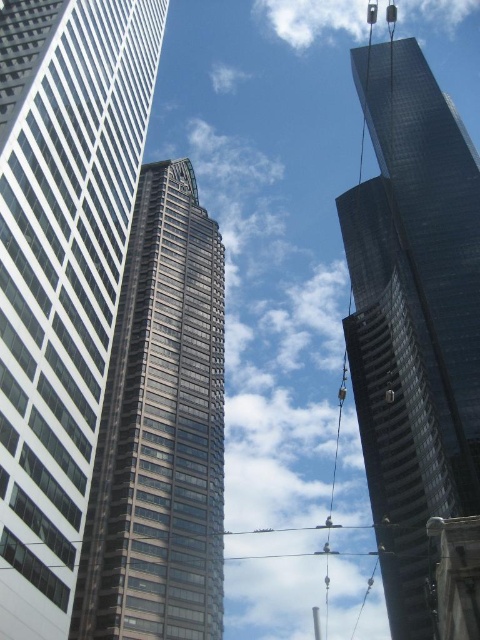
Is glossy glass skyscraper at upper right thinner than glassy reflective skyscraper at center?

Incorrect, glossy glass skyscraper at upper right's width is not less than glassy reflective skyscraper at center's.

This screenshot has width=480, height=640. Describe the element at coordinates (414, 317) in the screenshot. I see `glossy glass skyscraper at upper right` at that location.

Which is in front, point (395, 278) or point (126, 552)?

Point (126, 552) is more forward.

Find the location of `glossy glass skyscraper at upper right`. glossy glass skyscraper at upper right is located at coordinates coord(414,317).

Is white glass skyscraper at left closer to camera compared to glassy reflective skyscraper at center?

That is True.

Consider the image. Does white glass skyscraper at left have a lesser width compared to glassy reflective skyscraper at center?

Indeed, white glass skyscraper at left has a lesser width compared to glassy reflective skyscraper at center.

The width and height of the screenshot is (480, 640). Describe the element at coordinates (61, 273) in the screenshot. I see `white glass skyscraper at left` at that location.

Where is `white glass skyscraper at left`? white glass skyscraper at left is located at coordinates (61, 273).

Image resolution: width=480 pixels, height=640 pixels. Describe the element at coordinates (61, 273) in the screenshot. I see `white glass skyscraper at left` at that location.

Can you confirm if white glass skyscraper at left is wider than glossy glass skyscraper at upper right?

No, white glass skyscraper at left is not wider than glossy glass skyscraper at upper right.

Is point (94, 56) farther from camera compared to point (403, 312)?

That is False.

Where is `white glass skyscraper at left`? Image resolution: width=480 pixels, height=640 pixels. white glass skyscraper at left is located at coordinates (61, 273).